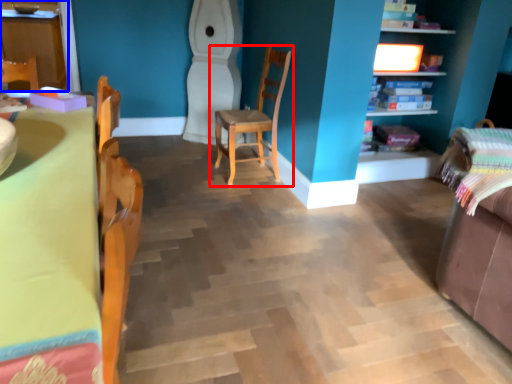
Question: Which point is closer to the camera, chair (highlighted by a red box) or cabinetry (highlighted by a blue box)?

Choices:
 (A) chair
 (B) cabinetry

Answer: (A)